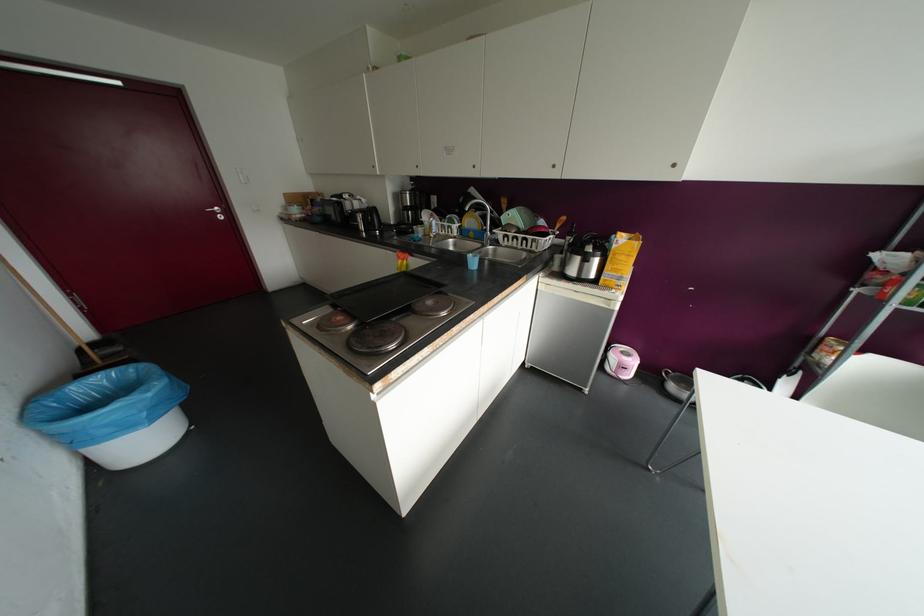
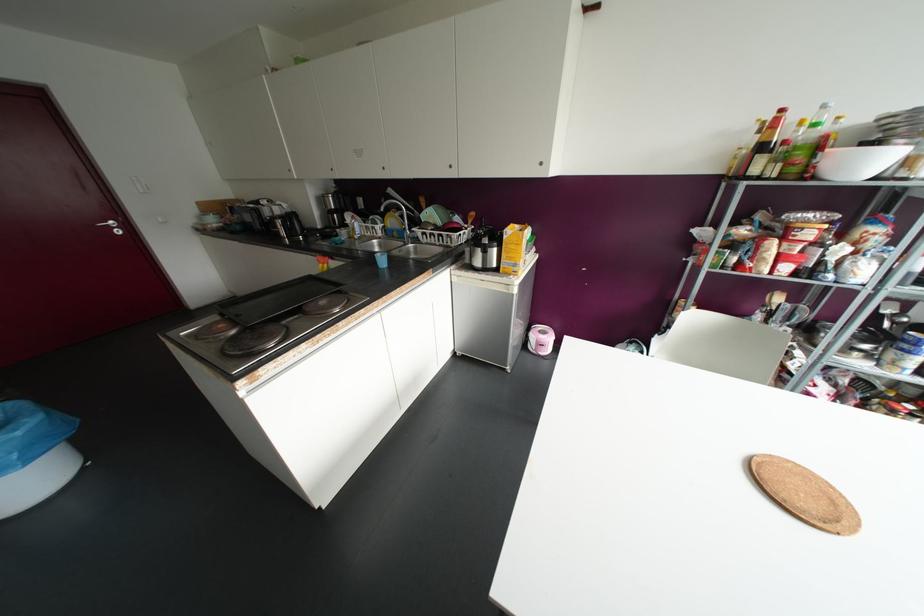
The point at (472,262) is marked in the first image. Where is the corresponding point in the second image?

(382, 261)